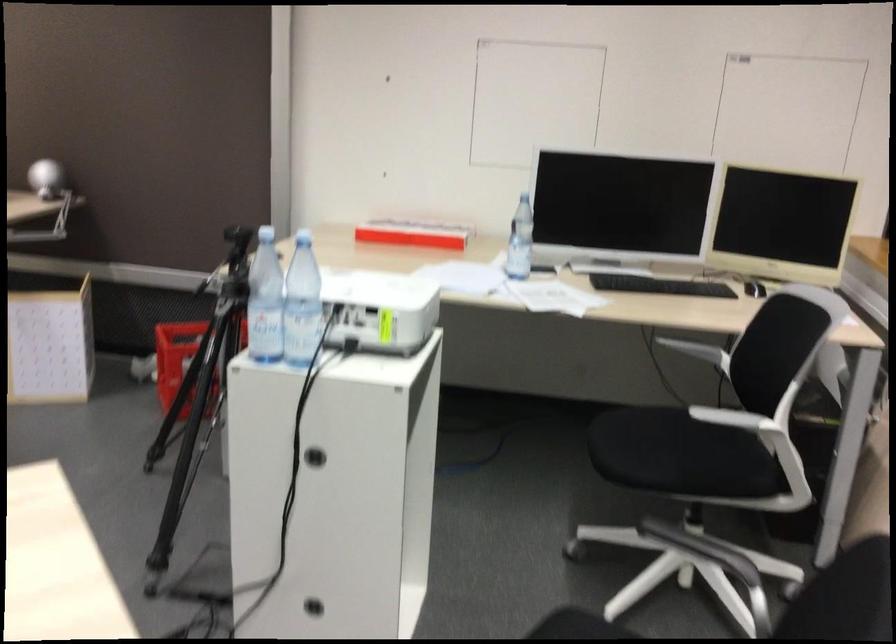
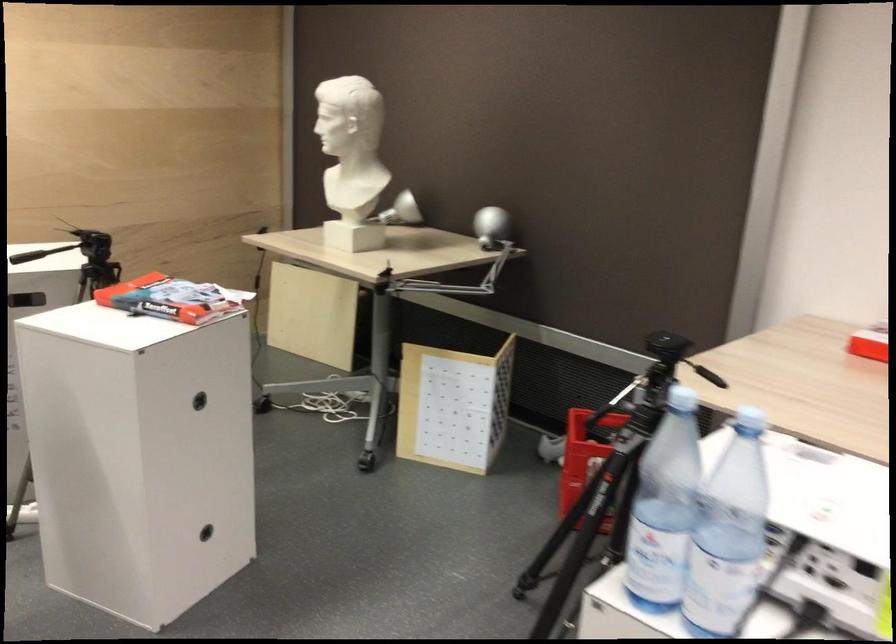
Question: How did the camera likely rotate?

Choices:
 (A) Left
 (B) Right
 (C) Up
 (D) Down

Answer: (A)